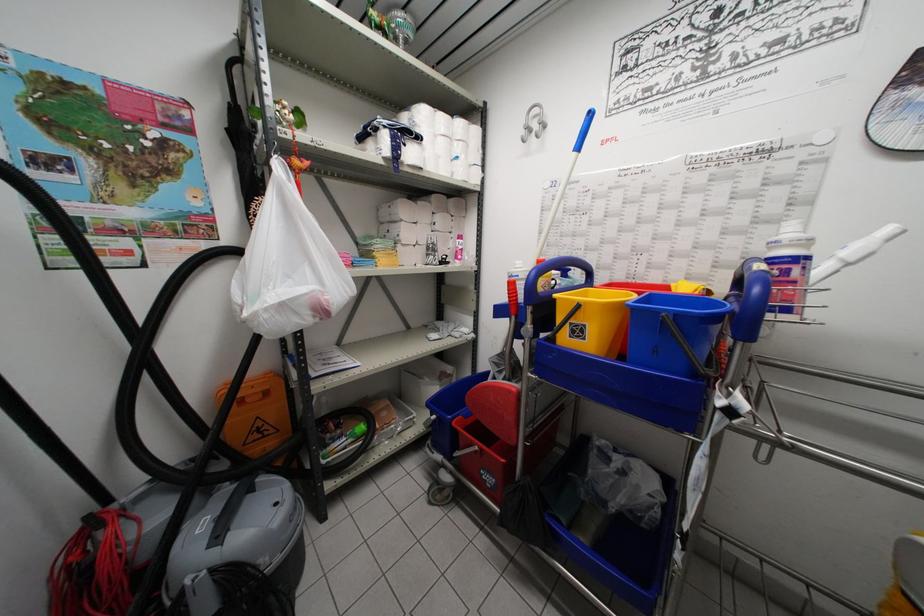
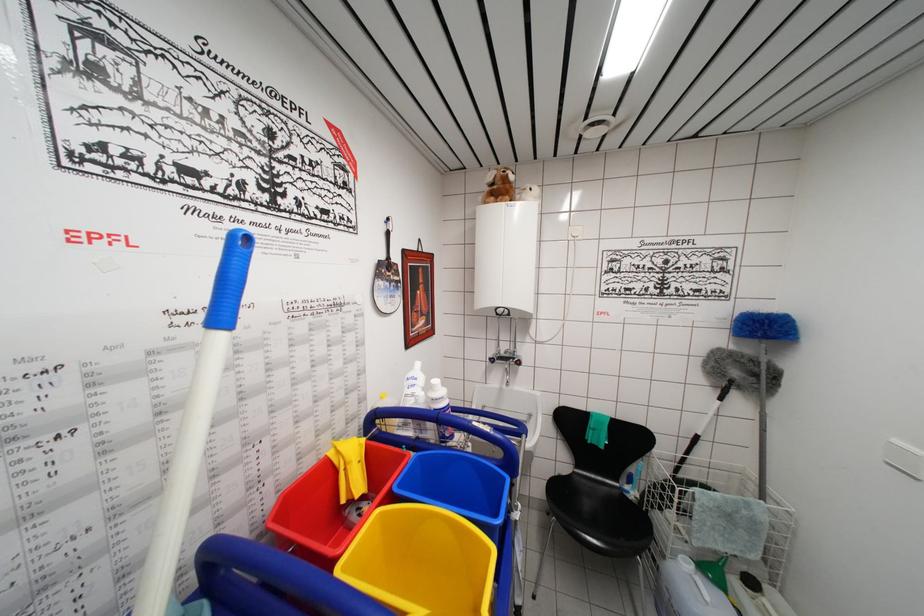
Question: The camera is either moving clockwise (left) or counter-clockwise (right) around the object. The first image is from the beginning of the video and the second image is from the end. Is the camera moving left or right when shooting the video?

Choices:
 (A) Left
 (B) Right

Answer: (A)